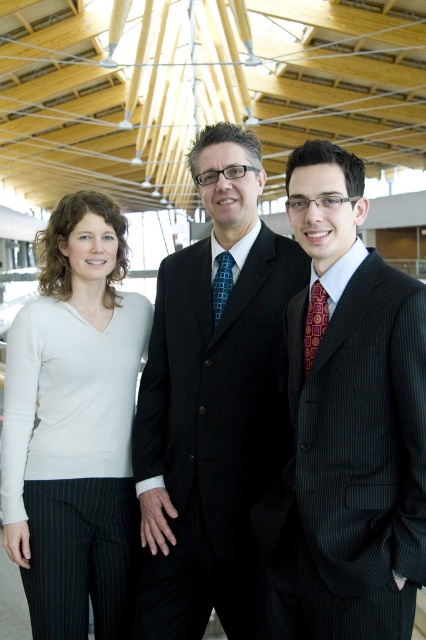
You are a photographer setting up a shoot in this scene. You need to ensure that both the dark pinstripe suit at center and the white matte sweater at left are visible in the frame. Based on their positions, which one is closer to the camera?

The dark pinstripe suit at center is in front of the white matte sweater at left, so it is closer to the camera.

You are standing in the room and want to place a small potted plant between the two points, point (244,516) and point (31,508). Which point should the plant be closer to to ensure it is placed in front of the other point?

The plant should be placed closer to point (244,516) because it is in front of point (31,508).